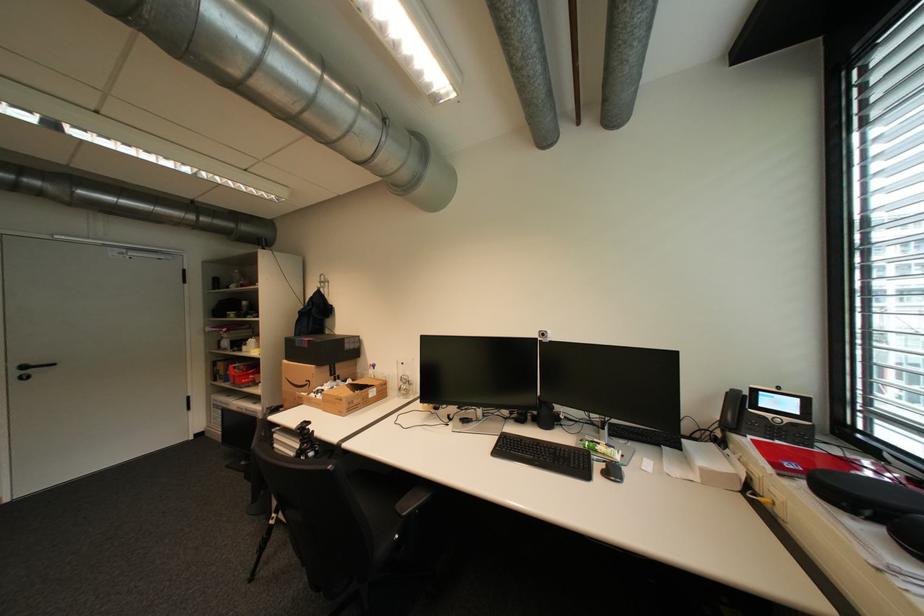
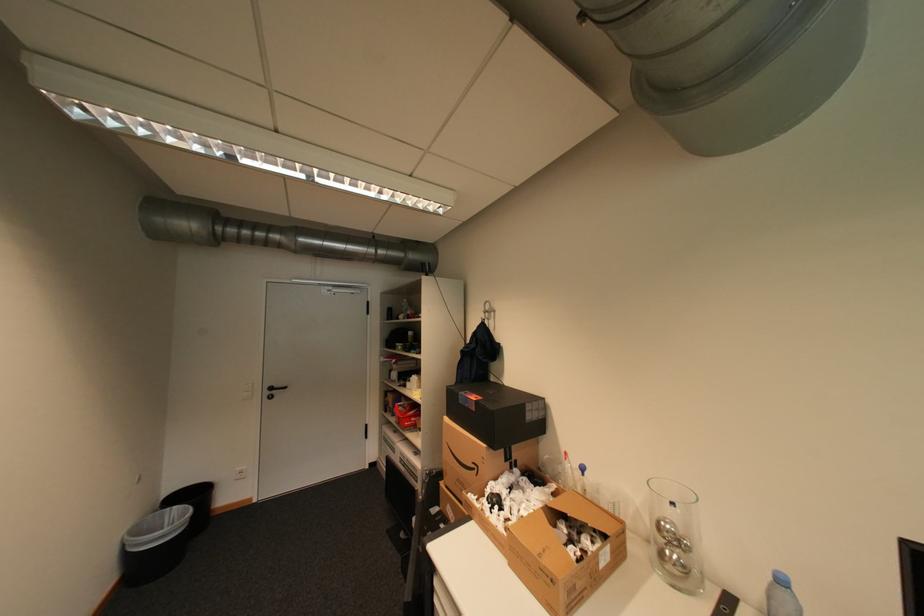
Where in the second image is the point corresponding to (310,346) from the first image?

(476, 406)